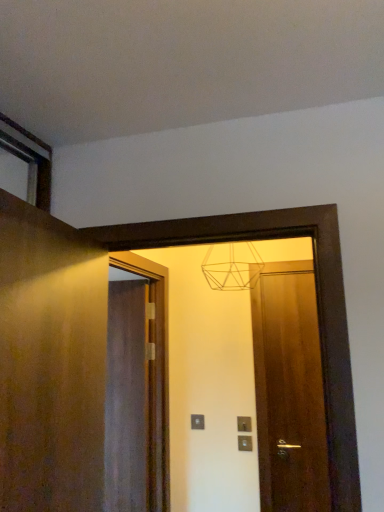
Question: Could matte wooden mirror at center be considered to be inside matte brown door at center, the 1th door positioned from the right?

Choices:
 (A) no
 (B) yes

Answer: (A)

Question: Is matte brown door at center, the 1th door positioned from the right, looking in the opposite direction of matte wooden mirror at center?

Choices:
 (A) yes
 (B) no

Answer: (B)

Question: Considering the relative sizes of matte brown door at center, positioned as the third door in left-to-right order, and matte wooden mirror at center in the image provided, is matte brown door at center, positioned as the third door in left-to-right order, wider than matte wooden mirror at center?

Choices:
 (A) yes
 (B) no

Answer: (B)

Question: Considering the relative sizes of matte brown door at center, the 2th door when ordered from back to front, and matte wooden mirror at center in the image provided, is matte brown door at center, the 2th door when ordered from back to front, shorter than matte wooden mirror at center?

Choices:
 (A) yes
 (B) no

Answer: (B)

Question: Is matte brown door at center, the 2th door when ordered from back to front, positioned far away from matte wooden mirror at center?

Choices:
 (A) yes
 (B) no

Answer: (B)

Question: Considering the relative sizes of matte brown door at center, the 2th door when ordered from back to front, and matte wooden mirror at center in the image provided, is matte brown door at center, the 2th door when ordered from back to front, thinner than matte wooden mirror at center?

Choices:
 (A) yes
 (B) no

Answer: (A)

Question: Is matte wooden mirror at center further to the viewer compared to matte gray electric outlet at center, arranged as the 1th electric outlet when viewed from the left?

Choices:
 (A) yes
 (B) no

Answer: (B)

Question: From a real-world perspective, is matte wooden mirror at center on matte gray electric outlet at center, which is the first electric outlet in back-to-front order?

Choices:
 (A) no
 (B) yes

Answer: (B)

Question: Is the surface of matte wooden mirror at center in direct contact with matte gray electric outlet at center, which is the second electric outlet from right to left?

Choices:
 (A) yes
 (B) no

Answer: (B)

Question: Considering the relative sizes of matte wooden mirror at center and matte gray electric outlet at center, which is the second electric outlet from right to left, in the image provided, is matte wooden mirror at center smaller than matte gray electric outlet at center, which is the second electric outlet from right to left,?

Choices:
 (A) no
 (B) yes

Answer: (A)

Question: Is matte wooden mirror at center oriented towards matte gray electric outlet at center, the 2th electric outlet in the front-to-back sequence?

Choices:
 (A) no
 (B) yes

Answer: (A)

Question: Is matte wooden mirror at center oriented away from matte gray electric outlet at center, the 2th electric outlet in the front-to-back sequence?

Choices:
 (A) no
 (B) yes

Answer: (B)

Question: Considering the relative sizes of wooden door at left, which is the third door in back-to-front order, and matte gray electric outlet at center, which is the second electric outlet from right to left, in the image provided, is wooden door at left, which is the third door in back-to-front order, thinner than matte gray electric outlet at center, which is the second electric outlet from right to left,?

Choices:
 (A) no
 (B) yes

Answer: (A)